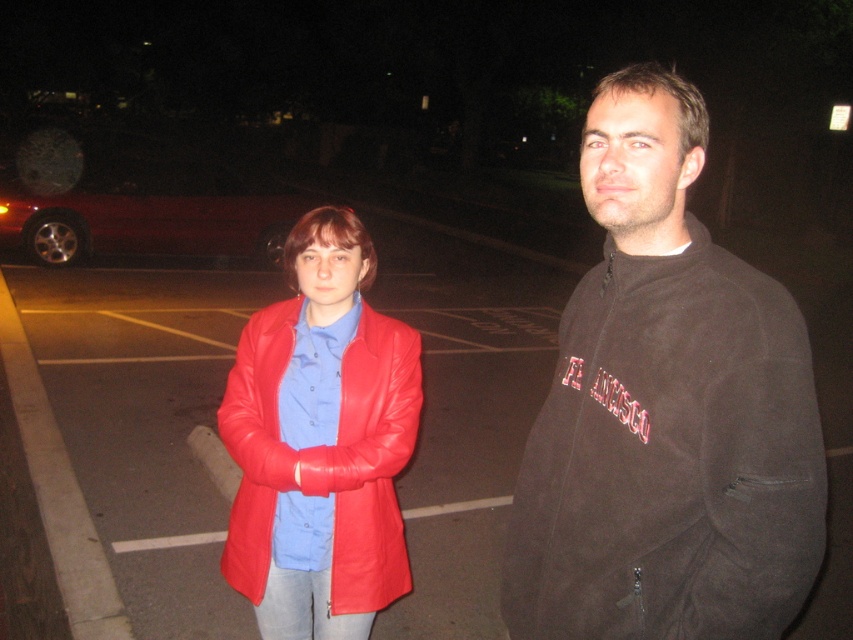
Question: Which point is closer to the camera taking this photo?

Choices:
 (A) (381, 374)
 (B) (260, 205)
 (C) (666, 413)

Answer: (C)

Question: Among these objects, which one is nearest to the camera?

Choices:
 (A) shiny red leather jacket at center
 (B) shiny red car at left
 (C) dark brown fleece jacket at center

Answer: (C)

Question: Does dark brown fleece jacket at center come in front of shiny red car at left?

Choices:
 (A) no
 (B) yes

Answer: (B)

Question: Does dark brown fleece jacket at center appear on the left side of shiny red leather jacket at center?

Choices:
 (A) no
 (B) yes

Answer: (A)

Question: Is shiny red leather jacket at center to the left of shiny red car at left from the viewer's perspective?

Choices:
 (A) no
 (B) yes

Answer: (A)

Question: Which object appears farthest from the camera in this image?

Choices:
 (A) dark brown fleece jacket at center
 (B) shiny red car at left
 (C) shiny red leather jacket at center

Answer: (B)